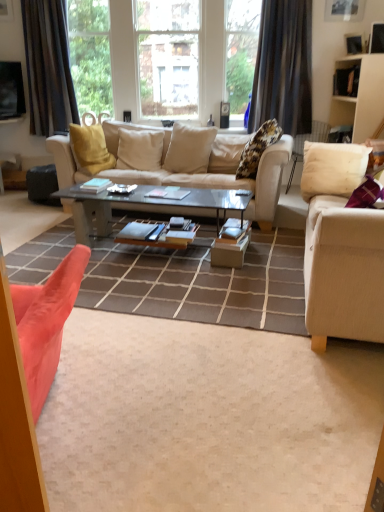
Question: In which direction should I rotate to look at beige fabric pillow at center, the fourth pillow when ordered from right to left?

Choices:
 (A) right
 (B) left

Answer: (B)

Question: Does velvet pink armchair at lower left have a lesser width compared to fluffy beige pillow at upper center, the third pillow viewed from the left?

Choices:
 (A) yes
 (B) no

Answer: (B)

Question: Are velvet pink armchair at lower left and fluffy beige pillow at upper center, placed as the 2th pillow when sorted from right to left, beside each other?

Choices:
 (A) yes
 (B) no

Answer: (B)

Question: Can fluffy beige pillow at upper center, the third pillow viewed from the left, be found inside velvet pink armchair at lower left?

Choices:
 (A) yes
 (B) no

Answer: (B)

Question: Does velvet pink armchair at lower left turn towards fluffy beige pillow at upper center, the third pillow viewed from the left?

Choices:
 (A) yes
 (B) no

Answer: (B)

Question: Can you confirm if velvet pink armchair at lower left is shorter than fluffy beige pillow at upper center, placed as the 2th pillow when sorted from right to left?

Choices:
 (A) no
 (B) yes

Answer: (B)

Question: Does velvet pink armchair at lower left have a greater height compared to fluffy beige pillow at upper center, the third pillow viewed from the left?

Choices:
 (A) yes
 (B) no

Answer: (B)

Question: Would you say velvet pink armchair at lower left is part of fluffy beige pillow at upper center, placed as the 2th pillow when sorted from right to left,'s contents?

Choices:
 (A) no
 (B) yes

Answer: (A)

Question: Does fluffy beige pillow at upper center, placed as the 2th pillow when sorted from right to left, come in front of velvet pink armchair at lower left?

Choices:
 (A) yes
 (B) no

Answer: (B)

Question: Is fluffy beige pillow at upper center, placed as the 2th pillow when sorted from right to left, located outside velvet pink armchair at lower left?

Choices:
 (A) yes
 (B) no

Answer: (A)

Question: Does fluffy beige pillow at upper center, the third pillow viewed from the left, have a greater width compared to velvet pink armchair at lower left?

Choices:
 (A) no
 (B) yes

Answer: (A)

Question: Does fluffy beige pillow at upper center, placed as the 2th pillow when sorted from right to left, appear on the right side of velvet pink armchair at lower left?

Choices:
 (A) yes
 (B) no

Answer: (A)

Question: Is fluffy beige pillow at upper center, placed as the 2th pillow when sorted from right to left, turned away from velvet pink armchair at lower left?

Choices:
 (A) yes
 (B) no

Answer: (B)

Question: Are beige fabric couch at center, placed as the second studio couch when sorted from right to left, and dark gray textured curtain at left, the 2th curtain when ordered from right to left, beside each other?

Choices:
 (A) no
 (B) yes

Answer: (A)